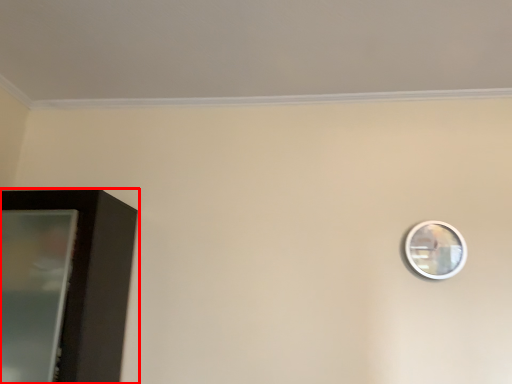
Question: From the image, what is the correct spatial relationship of furniture (annotated by the red box) in relation to mirror?

Choices:
 (A) left
 (B) right

Answer: (A)